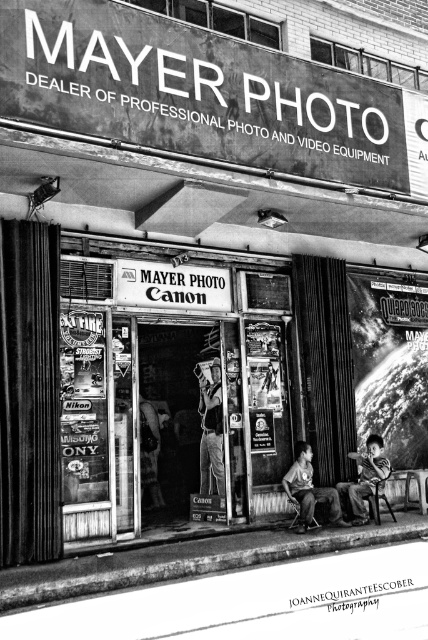
Question: Is metallic glass door at center to the left of metallic signboard at upper center from the viewer's perspective?

Choices:
 (A) yes
 (B) no

Answer: (A)

Question: Estimate the real-world distances between objects in this image. Which object is closer to the black matte sign at center?

Choices:
 (A) matte black person at center
 (B) metallic silver helmet at center
 (C) metallic signboard at upper center
 (D) matte gray shirt at center

Answer: (B)

Question: Which of the following is the farthest from the observer?

Choices:
 (A) metallic silver helmet at center
 (B) black matte sign at center
 (C) metallic signboard at upper center
 (D) matte black person at center

Answer: (A)

Question: Where is metallic silver helmet at center located in relation to matte black person at center in the image?

Choices:
 (A) below
 (B) above

Answer: (B)

Question: Which of the following is the closest to the observer?

Choices:
 (A) (201, 422)
 (B) (303, 506)

Answer: (B)

Question: Can you confirm if metallic signboard at upper center is wider than matte black person at center?

Choices:
 (A) no
 (B) yes

Answer: (B)